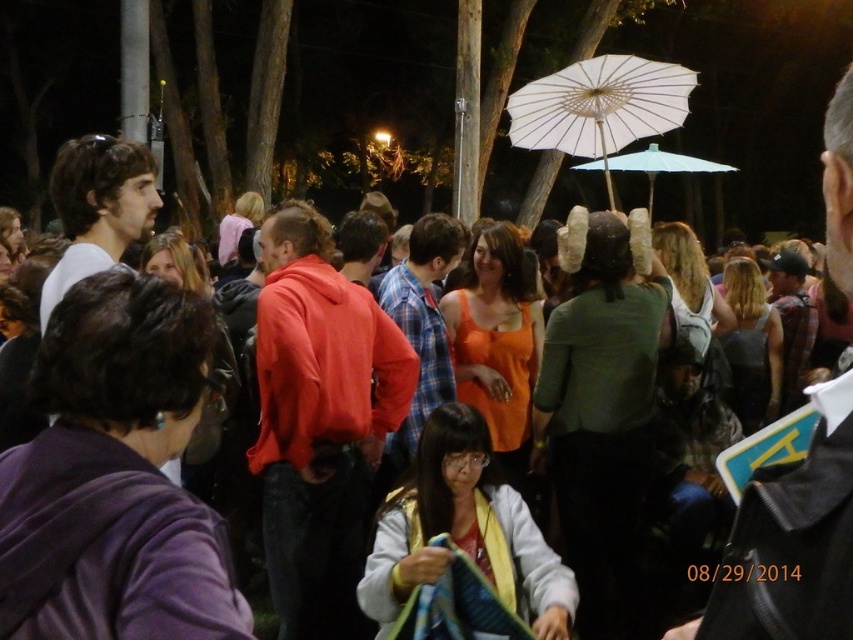
You are a photographer standing at the edge of a crowded outdoor event at night. You want to take a clear photo of the matte black jacket at center without blurring the background. Since the camera requires a minimum distance of 3 feet to focus properly, will you be able to capture the photo successfully?

The matte black jacket at center and viewer are 32.36 inches apart from each other. Since 32.36 inches is approximately 2.7 feet, which is less than the required 3 feet, the photographer cannot capture the photo successfully as the camera won

You are at a nighttime gathering and want to locate the person with the matte white hair at upper left. Where should you look relative to the person wearing the matte black jacket at center?

The matte white hair at upper left is above the matte black jacket at center, so you should look upwards from the matte black jacket at center to find the matte white hair at upper left.

You are standing at the point marked as point (791, 544) in the image. What object is directly in front of you?

The matte black jacket at center is directly in front of you at point (791, 544).